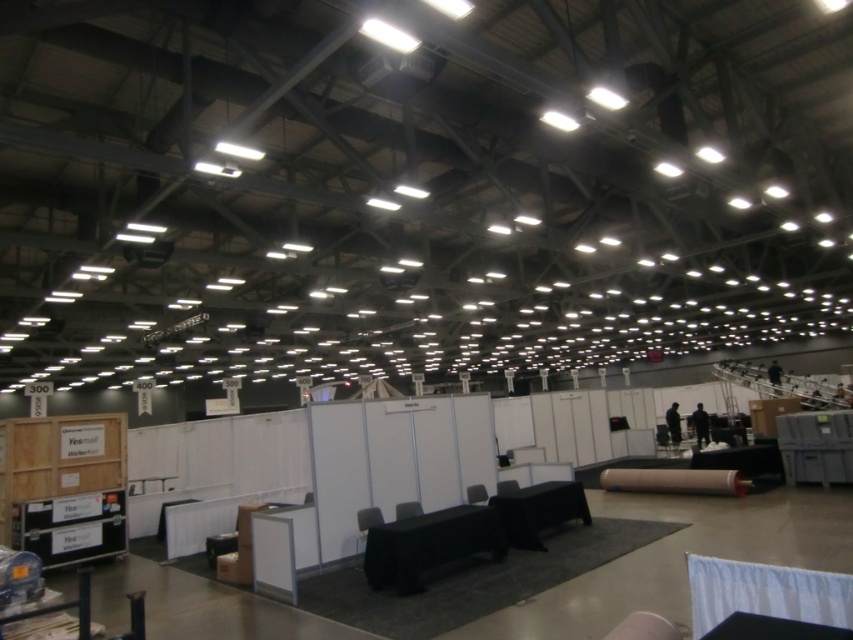
Who is more forward, (395, 504) or (502, 492)?

Point (395, 504)

Is point (401, 516) in front of point (498, 488)?

Yes.

Does point (407, 516) come closer to viewer compared to point (502, 492)?

Yes, it is in front of point (502, 492).

The height and width of the screenshot is (640, 853). What are the coordinates of `matte black chair at center` in the screenshot? It's located at (407, 509).

Is matte black chair at center above matte gray chair at center?

Correct, matte black chair at center is located above matte gray chair at center.

Does matte black chair at center have a smaller size compared to matte gray chair at center?

Yes, matte black chair at center is smaller than matte gray chair at center.

Locate an element on the screen. This screenshot has height=640, width=853. matte black chair at center is located at coordinates (407, 509).

I want to click on matte black chair at center, so click(407, 509).

What do you see at coordinates (675, 481) in the screenshot? The width and height of the screenshot is (853, 640). I see `matte cardboard roll at center` at bounding box center [675, 481].

Who is more forward, (683, 480) or (514, 486)?

Point (514, 486) is more forward.

You are a GUI agent. You are given a task and a screenshot of the screen. Output one action in this format:
    pyautogui.click(x=<x>, y=<y>)
    Task: Click on the matte cardboard roll at center
    The image size is (853, 640).
    Given the screenshot: What is the action you would take?
    pyautogui.click(x=675, y=481)